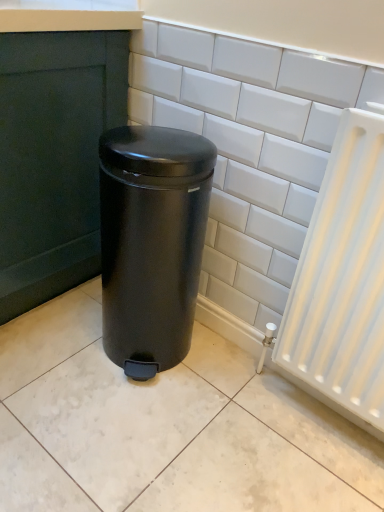
Find the location of `white glossy tile at center`. white glossy tile at center is located at coordinates (249, 147).

Measure the distance between white glossy tile at center and camera.

white glossy tile at center is 87.21 centimeters from camera.

The image size is (384, 512). What do you see at coordinates (249, 147) in the screenshot?
I see `white glossy tile at center` at bounding box center [249, 147].

Locate an element on the screen. The height and width of the screenshot is (512, 384). matte black trash can at center is located at coordinates (152, 242).

The width and height of the screenshot is (384, 512). What do you see at coordinates (152, 242) in the screenshot?
I see `matte black trash can at center` at bounding box center [152, 242].

Where is `white glossy tile at center`? Image resolution: width=384 pixels, height=512 pixels. white glossy tile at center is located at coordinates (249, 147).

Is matte black trash can at center at the left side of white glossy tile at center?

Yes.

Is matte black trash can at center behind white glossy tile at center?

Yes, matte black trash can at center is behind white glossy tile at center.

Which point is more distant from viewer, (159, 298) or (220, 210)?

The point (220, 210) is farther from the camera.

From the image's perspective, which object appears higher, matte black trash can at center or white glossy tile at center?

white glossy tile at center.

From a real-world perspective, is matte black trash can at center physically below white glossy tile at center?

Indeed, from a real-world perspective, matte black trash can at center is positioned beneath white glossy tile at center.

Which object is thinner, matte black trash can at center or white glossy tile at center?

white glossy tile at center is thinner.

Who is taller, matte black trash can at center or white glossy tile at center?

With more height is white glossy tile at center.

Does matte black trash can at center have a larger size compared to white glossy tile at center?

Correct, matte black trash can at center is larger in size than white glossy tile at center.

Do you think matte black trash can at center is within white glossy tile at center, or outside of it?

matte black trash can at center exists outside the volume of white glossy tile at center.

Is matte black trash can at center in contact with white glossy tile at center?

No, matte black trash can at center is not beside white glossy tile at center.

Based on the photo, could you tell me if matte black trash can at center is turned towards white glossy tile at center?

No, matte black trash can at center is not oriented towards white glossy tile at center.

Measure the distance between matte black trash can at center and white glossy tile at center.

matte black trash can at center and white glossy tile at center are 8.63 inches apart from each other.

The width and height of the screenshot is (384, 512). What are the coordinates of `ceramic tile above the matte black trash can at center (from the image's perspective)` in the screenshot? It's located at (249, 147).

Looking at this image, considering the positions of objects white glossy tile at center and matte black trash can at center in the image provided, who is more to the left, white glossy tile at center or matte black trash can at center?

matte black trash can at center is more to the left.

Between white glossy tile at center and matte black trash can at center, which one is positioned behind?

matte black trash can at center.

Between point (327, 155) and point (103, 322), which one is positioned behind?

Point (103, 322)

From the image's perspective, would you say white glossy tile at center is shown under matte black trash can at center?

No.

Looking at this image, from a real-world perspective, is white glossy tile at center over matte black trash can at center?

Yes, from a real-world perspective, white glossy tile at center is above matte black trash can at center.

Between white glossy tile at center and matte black trash can at center, which one has larger width?

matte black trash can at center.

Considering the sizes of objects white glossy tile at center and matte black trash can at center in the image provided, who is shorter, white glossy tile at center or matte black trash can at center?

matte black trash can at center.

Can you confirm if white glossy tile at center is bigger than matte black trash can at center?

No, white glossy tile at center is not bigger than matte black trash can at center.

Would you say white glossy tile at center is outside matte black trash can at center?

Yes, white glossy tile at center is outside of matte black trash can at center.

Is white glossy tile at center positioned far away from matte black trash can at center?

They are positioned close to each other.

Could you tell me if white glossy tile at center is turned towards matte black trash can at center?

Yes, white glossy tile at center is turned towards matte black trash can at center.

The image size is (384, 512). What are the coordinates of `waste container to the left of white glossy tile at center` in the screenshot? It's located at pyautogui.click(x=152, y=242).

Identify the location of ceramic tile positioned vertically above the matte black trash can at center (from a real-world perspective). The height and width of the screenshot is (512, 384). (249, 147).

Identify the location of waste container below the white glossy tile at center (from a real-world perspective). This screenshot has height=512, width=384. (152, 242).